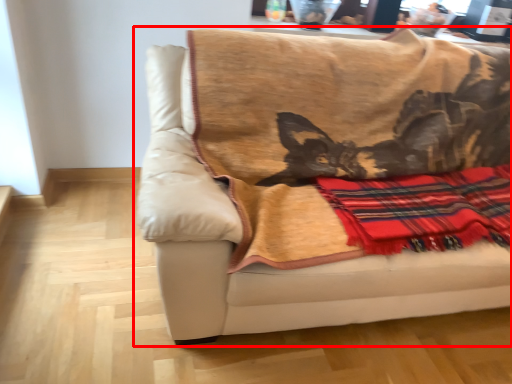
Question: From the image's perspective, where is studio couch (annotated by the red box) located relative to plaid?

Choices:
 (A) above
 (B) below

Answer: (A)